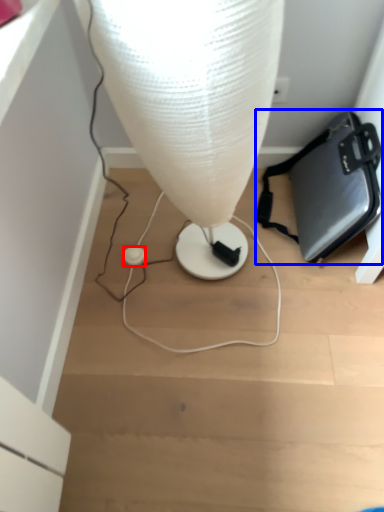
Question: Which of the following is the farthest to the observer, earphone (highlighted by a red box) or handbag (highlighted by a blue box)?

Choices:
 (A) earphone
 (B) handbag

Answer: (A)